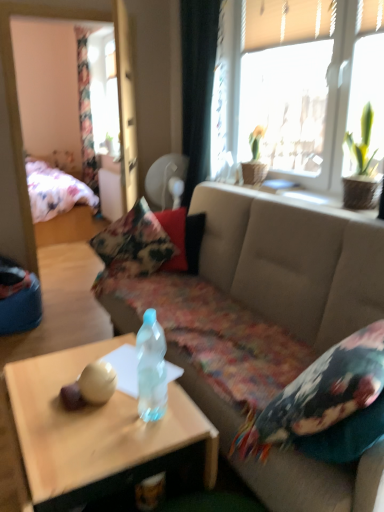
Question: Is point (192, 137) closer or farther from the camera than point (89, 165)?

Choices:
 (A) closer
 (B) farther

Answer: (A)

Question: Is black fabric curtain at upper center, the second curtain viewed from the left, to the left or to the right of floral fabric curtain at left, arranged as the 1th curtain when viewed from the back, in the image?

Choices:
 (A) right
 (B) left

Answer: (A)

Question: Which is nearer to the floral fabric pillow at right, positioned as the second pillow in left-to-right order?

Choices:
 (A) translucent plastic bottle at center
 (B) translucent plastic coffee table at center
 (C) green leafy plant in woven basket at upper right, which is counted as the 1th houseplant, starting from the right
 (D) beige fabric couch at center
 (E) floral fabric bed at left

Answer: (B)

Question: Which is farther from the floral fabric pillow at center, marked as the 1th pillow in a back-to-front arrangement?

Choices:
 (A) black fabric curtain at upper center, which appears as the 2th curtain when viewed from the back
 (B) translucent plastic bottle at center
 (C) translucent plastic coffee table at center
 (D) floral fabric pillow at right, which ranks as the 1th pillow in front-to-back order
 (E) beige fabric couch at center

Answer: (D)